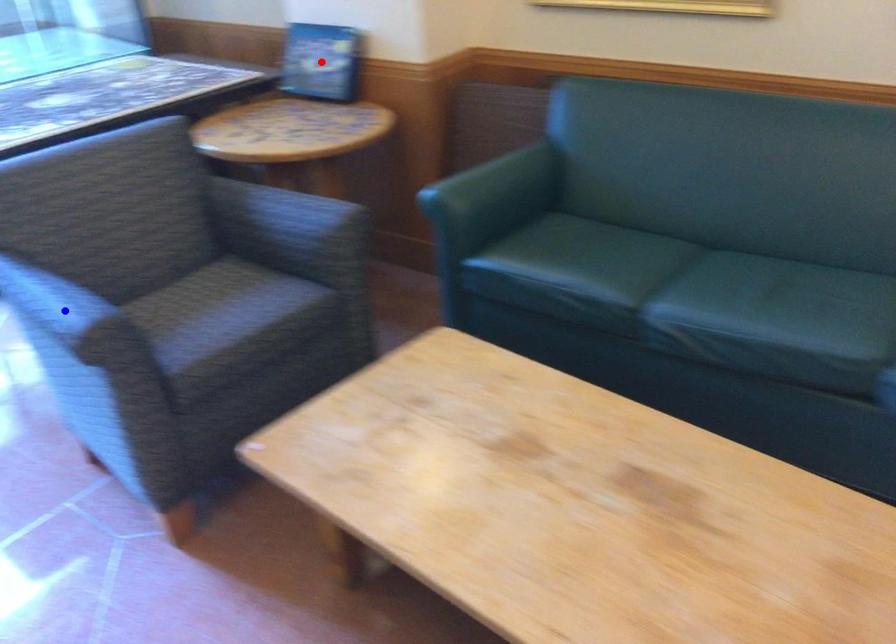
Question: In the image, two points are highlighted. Which point is nearer to the camera? Reply with the corresponding letter.

Choices:
 (A) blue point
 (B) red point

Answer: (A)